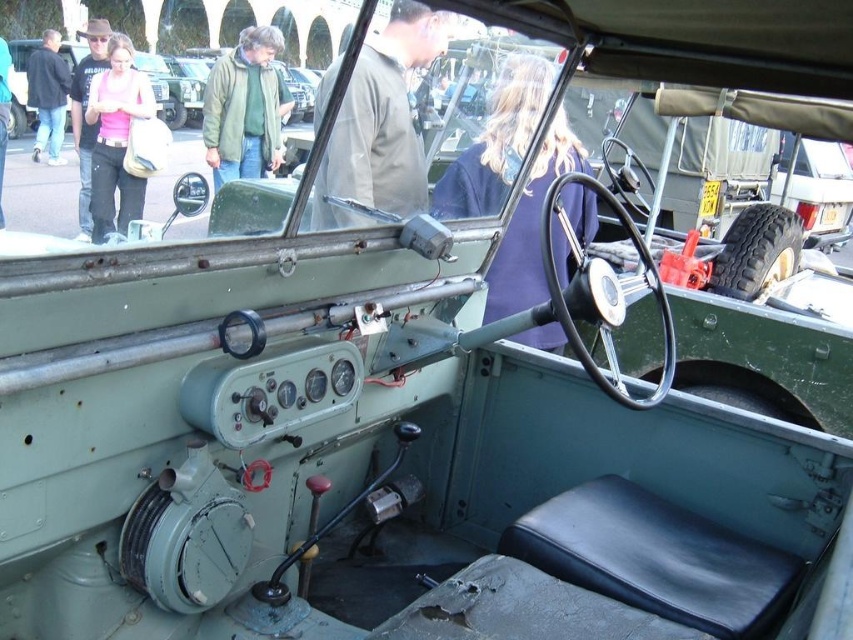
Question: Is matte gray jacket at center wider than denim jacket at upper left?

Choices:
 (A) no
 (B) yes

Answer: (A)

Question: Can you confirm if matte gray jacket at center is bigger than light blue jeans at lower left?

Choices:
 (A) yes
 (B) no

Answer: (A)

Question: Does matte gray jacket at center appear over light blue jeans at lower left?

Choices:
 (A) no
 (B) yes

Answer: (A)

Question: Which of these objects is positioned farthest from the matte gray jacket at center?

Choices:
 (A) green fuzzy jacket at upper center
 (B) blue fabric at center
 (C) matte black jacket at upper left

Answer: (C)

Question: Among these points, which one is nearest to the camera?

Choices:
 (A) (264, 147)
 (B) (538, 216)
 (C) (86, 20)
 (D) (192, 118)

Answer: (B)

Question: Considering the real-world distances, which object is farthest from the green fuzzy jacket at upper center?

Choices:
 (A) matte black jacket at upper left
 (B) matte green dashboard at upper center
 (C) pink fabric top at upper left
 (D) denim jacket at upper left

Answer: (D)